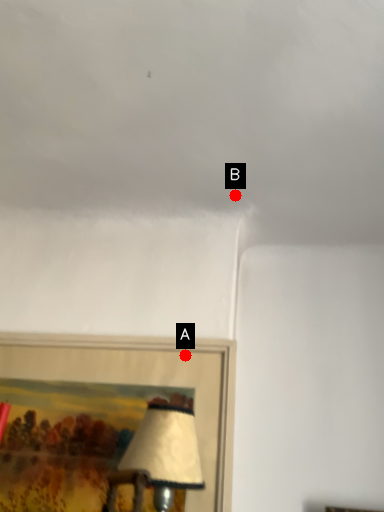
Question: Two points are circled on the image, labeled by A and B beside each circle. Which point is further to the camera?

Choices:
 (A) A is further
 (B) B is further

Answer: (B)